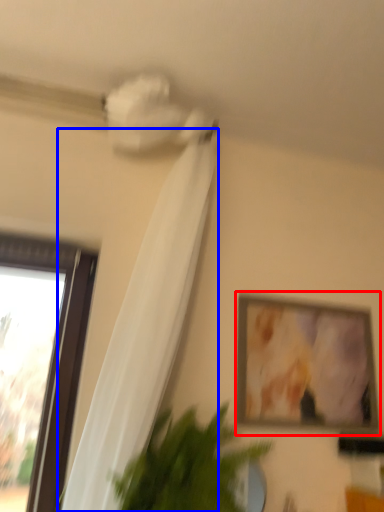
Question: Which of the following is the closest to the observer, picture frame (highlighted by a red box) or curtain (highlighted by a blue box)?

Choices:
 (A) picture frame
 (B) curtain

Answer: (B)